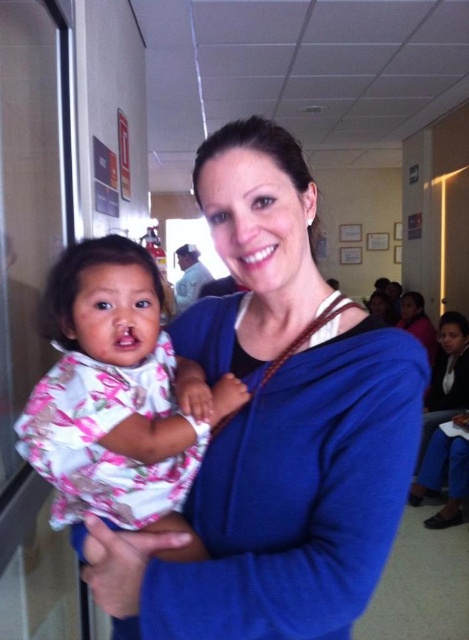
You are a photographer standing in the hospital room. You see the floral fabric baby at left. Can you take a clear photo of the baby from your current position?

The floral fabric baby at left and viewer are 29.12 inches apart. Since this distance is within a typical camera focus range, yes, you can take a clear photo of the baby from your current position.